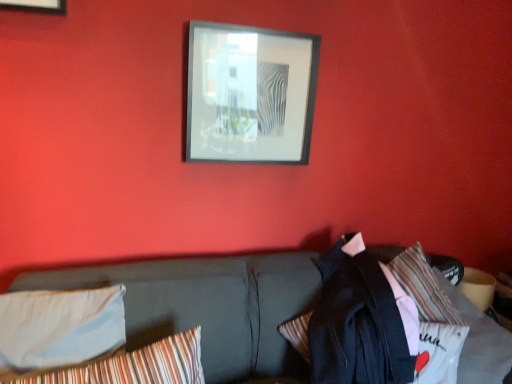
Question: Does dark gray fabric couch at center contain black matte picture frame at upper center?

Choices:
 (A) yes
 (B) no

Answer: (B)

Question: Is black matte picture frame at upper center at the back of dark gray fabric couch at center?

Choices:
 (A) no
 (B) yes

Answer: (A)

Question: Is dark gray fabric couch at center aimed at black matte picture frame at upper center?

Choices:
 (A) yes
 (B) no

Answer: (B)

Question: Does dark gray fabric couch at center have a larger size compared to black matte picture frame at upper center?

Choices:
 (A) no
 (B) yes

Answer: (B)

Question: Is dark gray fabric couch at center smaller than black matte picture frame at upper center?

Choices:
 (A) yes
 (B) no

Answer: (B)

Question: Is dark gray fabric couch at center taller or shorter than striped fabric pillow at lower left, placed as the second pillow when sorted from left to right?

Choices:
 (A) short
 (B) tall

Answer: (B)

Question: In terms of width, does dark gray fabric couch at center look wider or thinner when compared to striped fabric pillow at lower left, placed as the second pillow when sorted from left to right?

Choices:
 (A) thin
 (B) wide

Answer: (B)

Question: Considering the relative positions of dark gray fabric couch at center and striped fabric pillow at lower left, the 1th pillow positioned from the right, in the image provided, is dark gray fabric couch at center to the left or to the right of striped fabric pillow at lower left, the 1th pillow positioned from the right,?

Choices:
 (A) left
 (B) right

Answer: (B)

Question: Based on their sizes in the image, would you say dark gray fabric couch at center is bigger or smaller than striped fabric pillow at lower left, placed as the second pillow when sorted from left to right?

Choices:
 (A) big
 (B) small

Answer: (A)

Question: Do you think light blue fabric pillow at lower left, the 1th pillow when ordered from left to right, is within black matte picture frame at upper center, or outside of it?

Choices:
 (A) outside
 (B) inside

Answer: (A)

Question: From a real-world perspective, is light blue fabric pillow at lower left, the 1th pillow when ordered from left to right, physically located above or below black matte picture frame at upper center?

Choices:
 (A) above
 (B) below

Answer: (B)

Question: Visually, is light blue fabric pillow at lower left, the 2th pillow viewed from the right, positioned to the left or to the right of black matte picture frame at upper center?

Choices:
 (A) right
 (B) left

Answer: (B)

Question: Based on their sizes in the image, would you say light blue fabric pillow at lower left, the 1th pillow when ordered from left to right, is bigger or smaller than black matte picture frame at upper center?

Choices:
 (A) big
 (B) small

Answer: (A)

Question: From the image's perspective, is light blue fabric pillow at lower left, the 1th pillow when ordered from left to right, positioned above or below dark gray fabric couch at center?

Choices:
 (A) above
 (B) below

Answer: (A)

Question: Is light blue fabric pillow at lower left, the 2th pillow viewed from the right, spatially inside dark gray fabric couch at center, or outside of it?

Choices:
 (A) inside
 (B) outside

Answer: (A)